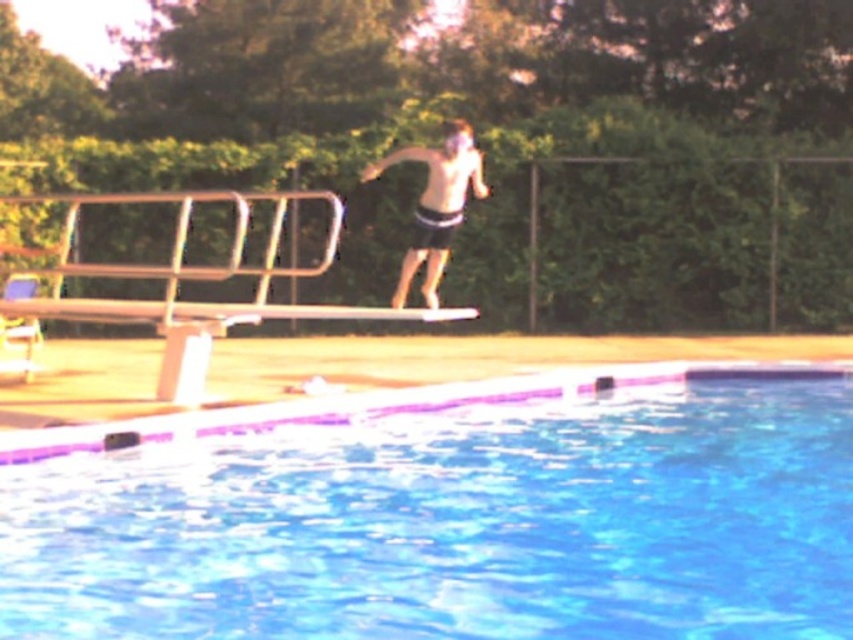
Question: Which of the following is the closest to the observer?

Choices:
 (A) (456, 179)
 (B) (648, 401)

Answer: (A)

Question: Which point is closer to the camera?

Choices:
 (A) (456, 180)
 (B) (366, 461)

Answer: (B)

Question: Can you confirm if transparent plastic water at lower center is positioned above dark gray shorts at center?

Choices:
 (A) yes
 (B) no

Answer: (B)

Question: Observing the image, what is the correct spatial positioning of transparent plastic water at lower center in reference to dark gray shorts at center?

Choices:
 (A) right
 (B) left

Answer: (B)

Question: Which object appears farthest from the camera in this image?

Choices:
 (A) dark gray shorts at center
 (B) transparent plastic water at lower center

Answer: (A)

Question: Is transparent plastic water at lower center to the right of dark gray shorts at center from the viewer's perspective?

Choices:
 (A) yes
 (B) no

Answer: (B)